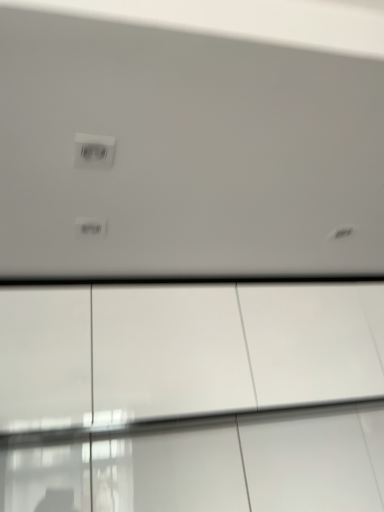
What do you see at coordinates (192, 398) in the screenshot? This screenshot has width=384, height=512. I see `transparent glass door at bottom` at bounding box center [192, 398].

The image size is (384, 512). I want to click on transparent glass door at bottom, so click(x=192, y=398).

Find the location of a particular element. The image size is (384, 512). transparent glass door at bottom is located at coordinates (192, 398).